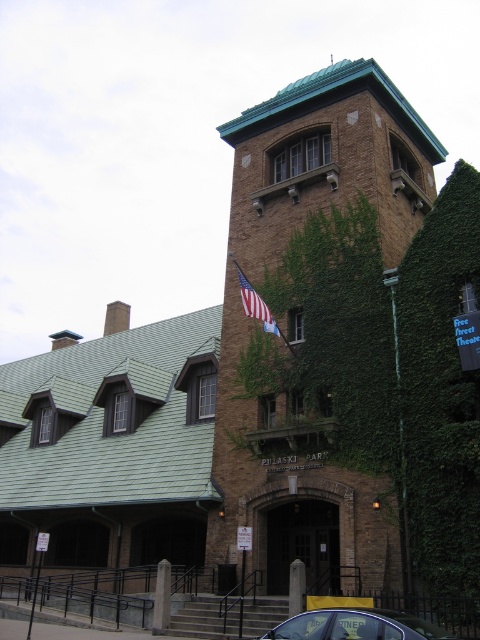
Can you confirm if green ivy-covered brick bell tower at upper center is positioned above metallic blue car at lower center?

Correct, green ivy-covered brick bell tower at upper center is located above metallic blue car at lower center.

Who is lower down, green ivy-covered brick bell tower at upper center or metallic blue car at lower center?

metallic blue car at lower center

Between point (368, 180) and point (307, 614), which one is positioned behind?

The point (368, 180) is behind.

Where is `green ivy-covered brick bell tower at upper center`? This screenshot has height=640, width=480. green ivy-covered brick bell tower at upper center is located at coordinates (274, 268).

Can you confirm if metallic blue car at lower center is shorter than american flag at center?

No.

Is metallic blue car at lower center further to the viewer compared to american flag at center?

No, it is not.

Who is more forward, (334, 618) or (261, 310)?

Point (334, 618) is in front.

Image resolution: width=480 pixels, height=640 pixels. What are the coordinates of `metallic blue car at lower center` in the screenshot? It's located at (356, 625).

Does green ivy-covered brick bell tower at upper center lie in front of american flag at center?

Yes, it is in front of american flag at center.

Measure the distance between green ivy-covered brick bell tower at upper center and american flag at center.

12.98 meters

Locate an element on the screen. green ivy-covered brick bell tower at upper center is located at coordinates (274, 268).